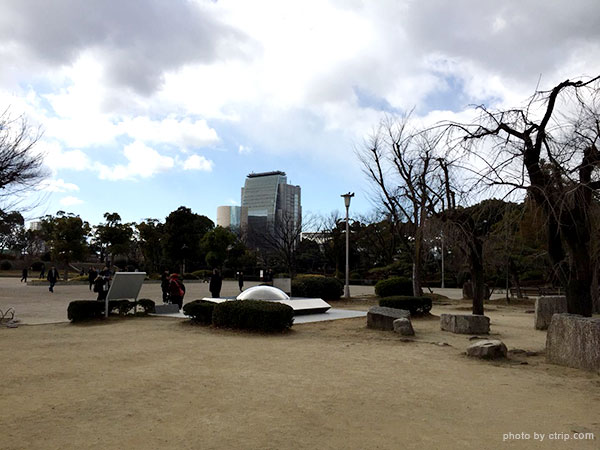
Locate an element on the screen. light is located at coordinates (347, 201), (440, 256).